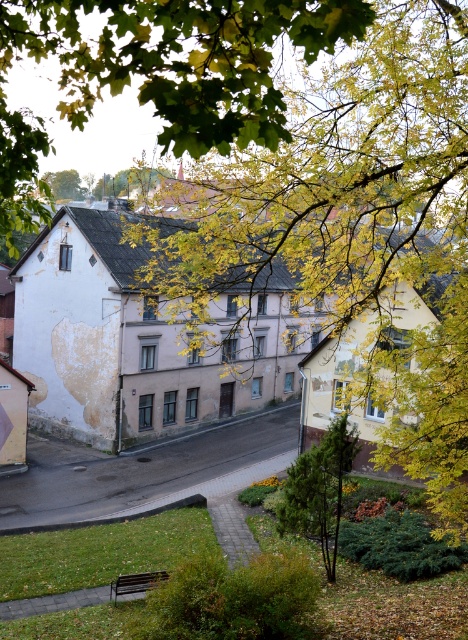
Which of these two, white painted wall at left or yellow-green leaves at upper center, stands shorter?

yellow-green leaves at upper center is shorter.

Is white painted wall at left positioned in front of yellow-green leaves at upper center?

No, white painted wall at left is further to the viewer.

Describe the element at coordinates (143, 337) in the screenshot. I see `white painted wall at left` at that location.

At what (x,y) coordinates should I click in order to perform the action: click on white painted wall at left. Please return your answer as a coordinate pair (x, y). Image resolution: width=468 pixels, height=640 pixels. Looking at the image, I should click on (143, 337).

Can you confirm if yellow leafy tree at upper center is positioned below green leafy tree at upper center?

Yes.

Is point (159, 170) positioned after point (58, 182)?

No.

From the picture: Who is more distant from viewer, (x=147, y=177) or (x=67, y=188)?

Result: The point (x=67, y=188) is behind.

Find the location of `yellow leafy tree at upper center`. yellow leafy tree at upper center is located at coordinates (130, 180).

Consider the image. Is yellow-green leaves at upper center shorter than wooden park bench at lower center?

In fact, yellow-green leaves at upper center may be taller than wooden park bench at lower center.

Who is more forward, (0, 195) or (124, 579)?

Point (0, 195) is in front.

Which is in front, point (280, 13) or point (129, 584)?

Positioned in front is point (280, 13).

This screenshot has height=640, width=468. Identify the location of yellow-green leaves at upper center. (180, 58).